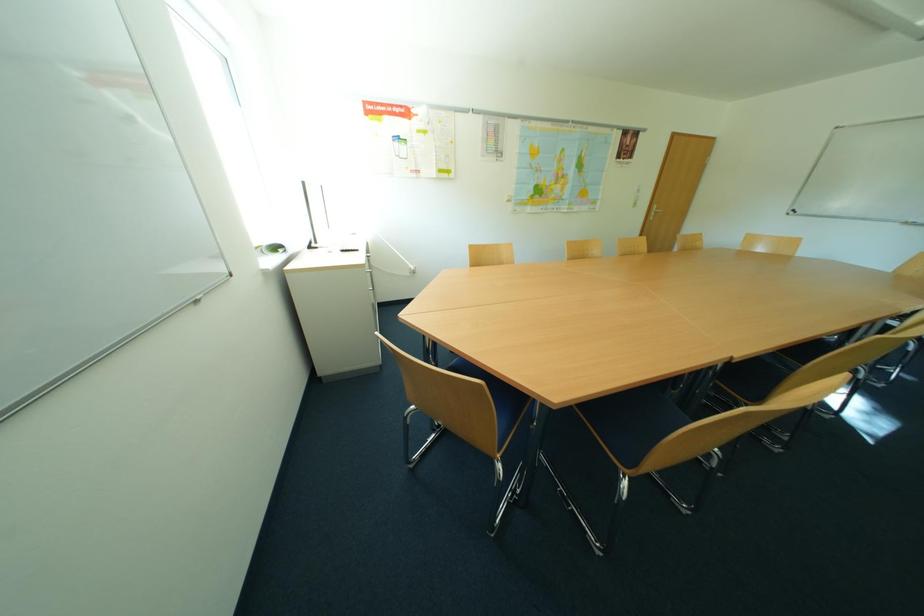
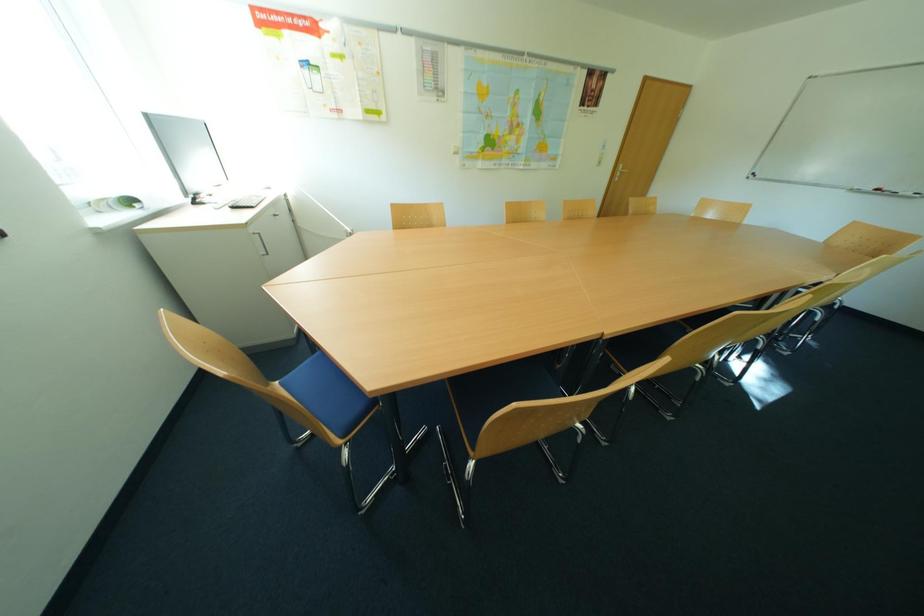
Question: The first image is from the beginning of the video and the second image is from the end. How did the camera likely rotate when shooting the video?

Choices:
 (A) Left
 (B) Right
 (C) Up
 (D) Down

Answer: (D)